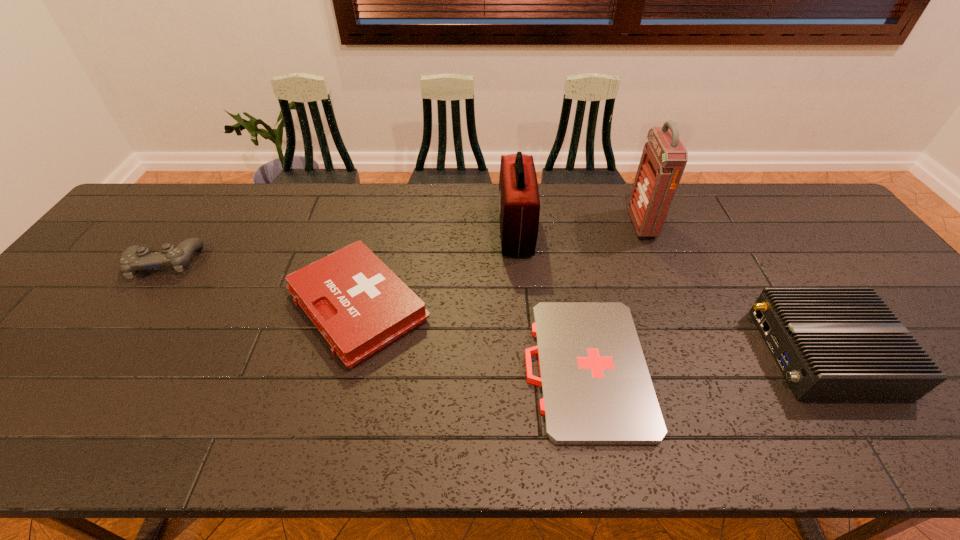
The image size is (960, 540). In order to click on the fifth object from left to right in this screenshot , I will do `click(664, 157)`.

Where is `the rightmost first-aid kit`? This screenshot has height=540, width=960. the rightmost first-aid kit is located at coordinates (664, 157).

Locate an element on the screen. This screenshot has width=960, height=540. the second tallest object is located at coordinates (519, 205).

The height and width of the screenshot is (540, 960). I want to click on the fourth shortest object, so click(832, 344).

Find the location of a particular element. This screenshot has width=960, height=540. the rightmost object is located at coordinates (832, 344).

Identify the location of the leftmost object. This screenshot has height=540, width=960. (134, 258).

This screenshot has height=540, width=960. In order to click on the second shortest first-aid kit in this screenshot , I will do `click(357, 303)`.

Locate an element on the screen. The width and height of the screenshot is (960, 540). the second object from left to right is located at coordinates (357, 303).

At what (x,y) coordinates should I click in order to perform the action: click on the shortest object. Please return your answer as a coordinate pair (x, y). The height and width of the screenshot is (540, 960). Looking at the image, I should click on (596, 389).

This screenshot has height=540, width=960. I want to click on vacant space positioned 0.200m on the front-facing side of the tallest first-aid kit, so click(x=567, y=224).